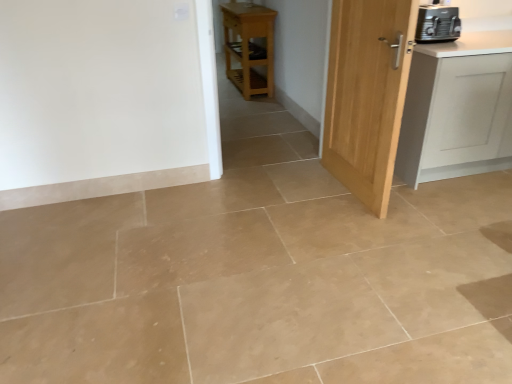
Question: Should I look upward or downward to see light wood door at center right?

Choices:
 (A) down
 (B) up

Answer: (B)

Question: Considering the relative positions of black plastic toaster at upper right and light wood door at center right in the image provided, is black plastic toaster at upper right in front of light wood door at center right?

Choices:
 (A) yes
 (B) no

Answer: (B)

Question: Is black plastic toaster at upper right far from light wood door at center right?

Choices:
 (A) yes
 (B) no

Answer: (B)

Question: Does black plastic toaster at upper right have a greater width compared to light wood door at center right?

Choices:
 (A) yes
 (B) no

Answer: (A)

Question: Can you confirm if black plastic toaster at upper right is bigger than light wood door at center right?

Choices:
 (A) no
 (B) yes

Answer: (A)

Question: Can you see black plastic toaster at upper right touching light wood door at center right?

Choices:
 (A) no
 (B) yes

Answer: (A)

Question: Is black plastic toaster at upper right facing towards light wood door at center right?

Choices:
 (A) yes
 (B) no

Answer: (B)

Question: Is white matte cabinet at right taller than light wood door at center right?

Choices:
 (A) yes
 (B) no

Answer: (B)

Question: Is the position of white matte cabinet at right less distant than that of light wood door at center right?

Choices:
 (A) yes
 (B) no

Answer: (B)

Question: Is white matte cabinet at right located outside light wood door at center right?

Choices:
 (A) no
 (B) yes

Answer: (B)

Question: From the image's perspective, is white matte cabinet at right beneath light wood door at center right?

Choices:
 (A) yes
 (B) no

Answer: (B)

Question: Is white matte cabinet at right wider than light wood door at center right?

Choices:
 (A) no
 (B) yes

Answer: (B)

Question: Is white matte cabinet at right placed right next to light wood door at center right?

Choices:
 (A) no
 (B) yes

Answer: (A)

Question: Is light wood door at center right aimed at light wood/matte table at center?

Choices:
 (A) no
 (B) yes

Answer: (A)